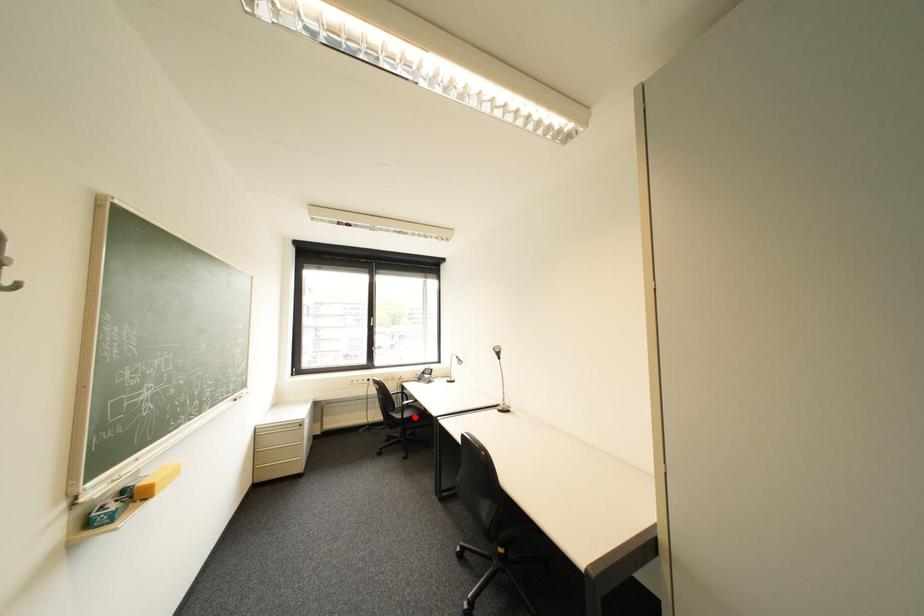
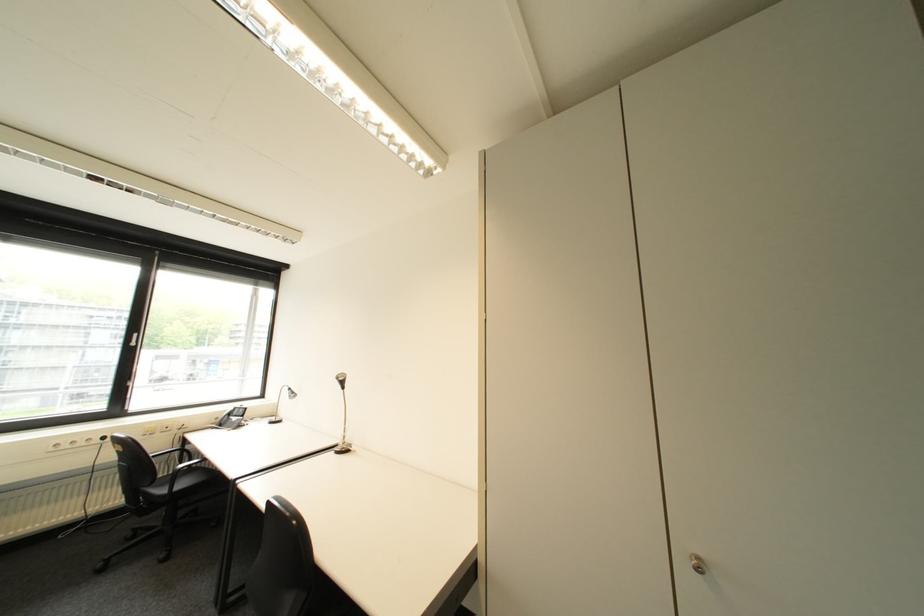
Locate, in the second image, the point that corresponds to the highlighted location in the first image.

(187, 488)